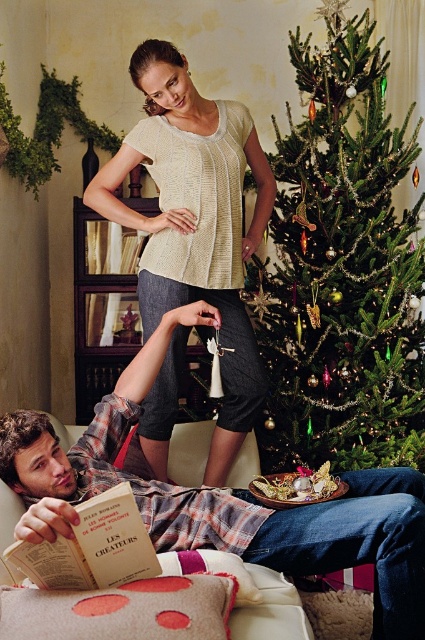
Is green textured christmas tree at center smaller than plaid fabric shirt at lower left?

No.

From the picture: Does green textured christmas tree at center have a larger size compared to plaid fabric shirt at lower left?

Correct, green textured christmas tree at center is larger in size than plaid fabric shirt at lower left.

Which is in front, point (334, 184) or point (107, 468)?

Point (107, 468) is in front.

You are a GUI agent. You are given a task and a screenshot of the screen. Output one action in this format:
    pyautogui.click(x=<x>, y=<y>)
    Task: Click on the green textured christmas tree at center
    The image size is (425, 640).
    Given the screenshot: What is the action you would take?
    pyautogui.click(x=340, y=268)

Can you confirm if green textured christmas tree at center is wider than knitted beige top at center?

Yes, green textured christmas tree at center is wider than knitted beige top at center.

Who is taller, green textured christmas tree at center or knitted beige top at center?

With more height is green textured christmas tree at center.

I want to click on green textured christmas tree at center, so click(340, 268).

Does plaid fabric shirt at lower left have a lesser width compared to knitted beige top at center?

Incorrect, plaid fabric shirt at lower left's width is not less than knitted beige top at center's.

Which is behind, point (158, 532) or point (172, 81)?

The point (172, 81) is more distant.

Where is `plaid fabric shirt at lower left`? plaid fabric shirt at lower left is located at coordinates (221, 497).